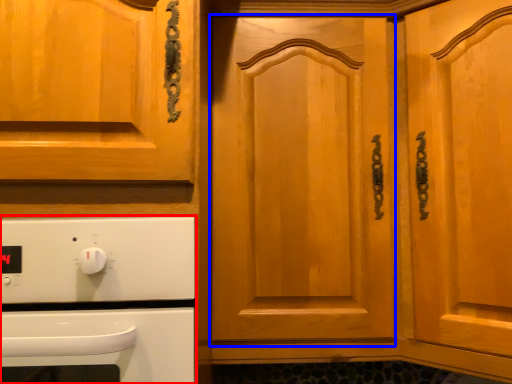
Question: Which of the following is the closest to the observer, home appliance (highlighted by a red box) or door (highlighted by a blue box)?

Choices:
 (A) home appliance
 (B) door

Answer: (A)